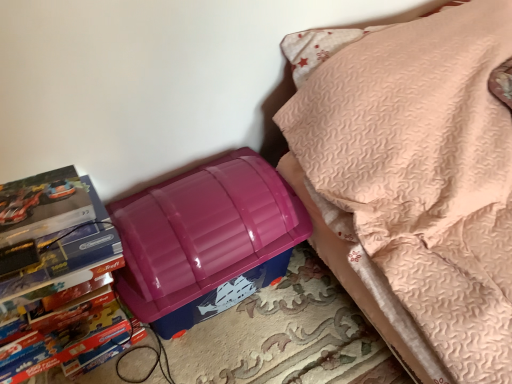
Question: Considering the relative sizes of glossy plastic lunch box at lower left and matte cardboard book at left in the image provided, is glossy plastic lunch box at lower left bigger than matte cardboard book at left?

Choices:
 (A) yes
 (B) no

Answer: (A)

Question: Could you tell me if glossy plastic lunch box at lower left is turned towards matte cardboard book at left?

Choices:
 (A) yes
 (B) no

Answer: (B)

Question: Is glossy plastic lunch box at lower left turned away from matte cardboard book at left?

Choices:
 (A) no
 (B) yes

Answer: (A)

Question: From the image's perspective, is glossy plastic lunch box at lower left on top of matte cardboard book at left?

Choices:
 (A) no
 (B) yes

Answer: (B)

Question: Considering the relative sizes of glossy plastic lunch box at lower left and matte cardboard book at left in the image provided, is glossy plastic lunch box at lower left wider than matte cardboard book at left?

Choices:
 (A) yes
 (B) no

Answer: (A)

Question: Is glossy plastic lunch box at lower left positioned far away from matte cardboard book at left?

Choices:
 (A) no
 (B) yes

Answer: (A)

Question: Are glossy plastic lunch box at lower left and purple plastic storage bin at lower left making contact?

Choices:
 (A) no
 (B) yes

Answer: (A)

Question: Is glossy plastic lunch box at lower left at the right side of purple plastic storage bin at lower left?

Choices:
 (A) no
 (B) yes

Answer: (A)

Question: Does glossy plastic lunch box at lower left have a smaller size compared to purple plastic storage bin at lower left?

Choices:
 (A) yes
 (B) no

Answer: (A)

Question: Does glossy plastic lunch box at lower left have a lesser height compared to purple plastic storage bin at lower left?

Choices:
 (A) yes
 (B) no

Answer: (A)

Question: Is glossy plastic lunch box at lower left facing away from purple plastic storage bin at lower left?

Choices:
 (A) no
 (B) yes

Answer: (A)

Question: Are glossy plastic lunch box at lower left and purple plastic storage bin at lower left far apart?

Choices:
 (A) no
 (B) yes

Answer: (A)

Question: Is matte cardboard book at left far from glossy plastic lunch box at lower left?

Choices:
 (A) no
 (B) yes

Answer: (A)